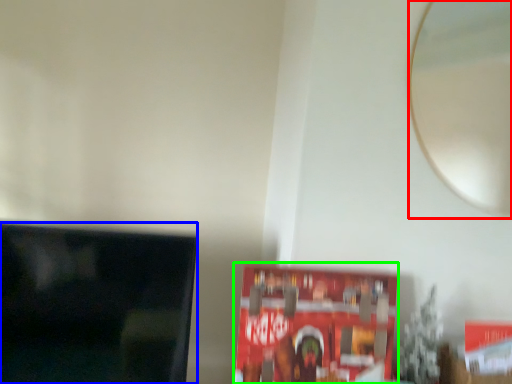
Question: Considering the real-world distances, which object is closest to mirror (highlighted by a red box)? television (highlighted by a blue box) or paperback book (highlighted by a green box).

Choices:
 (A) television
 (B) paperback book

Answer: (B)